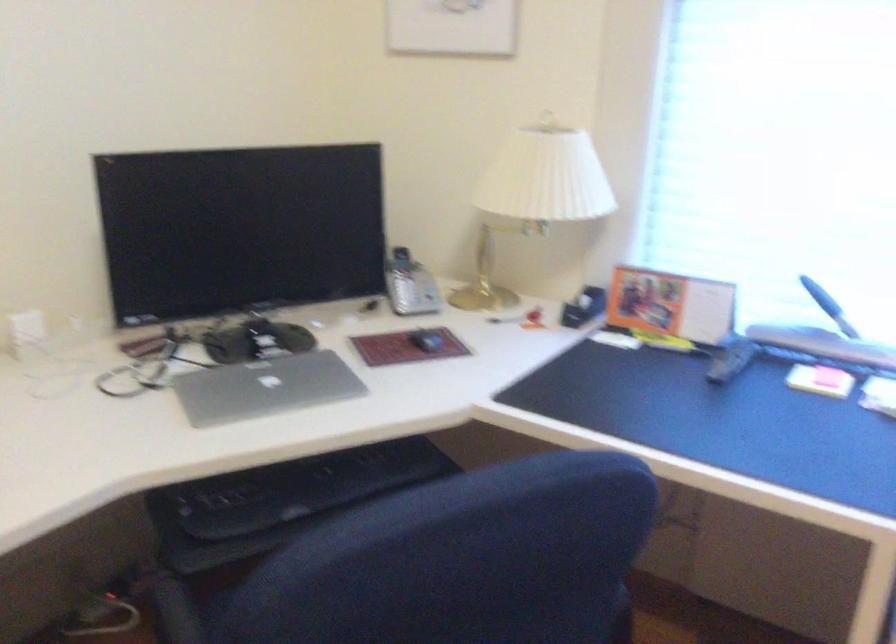
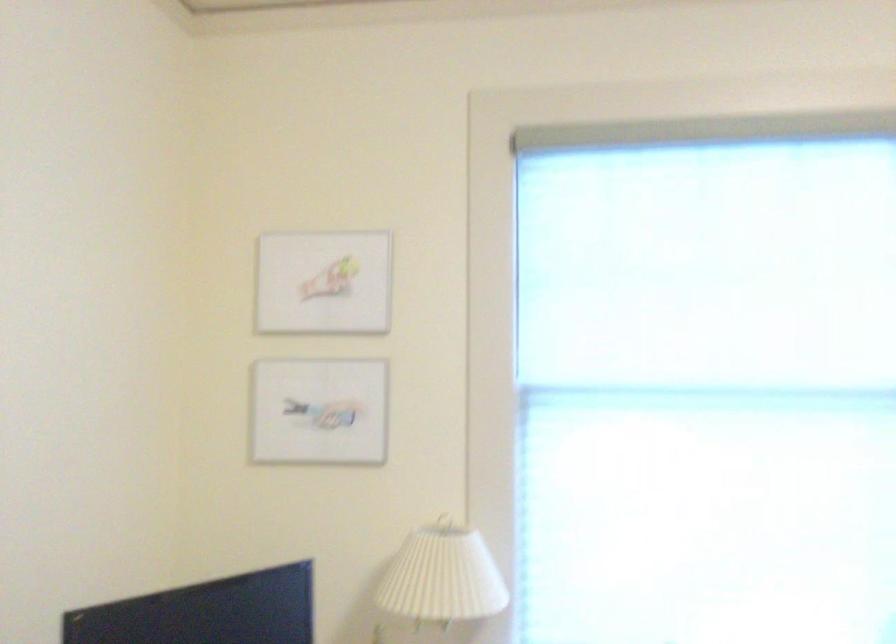
In the second image, find the point that corresponds to point 527,176 in the first image.

(443, 576)